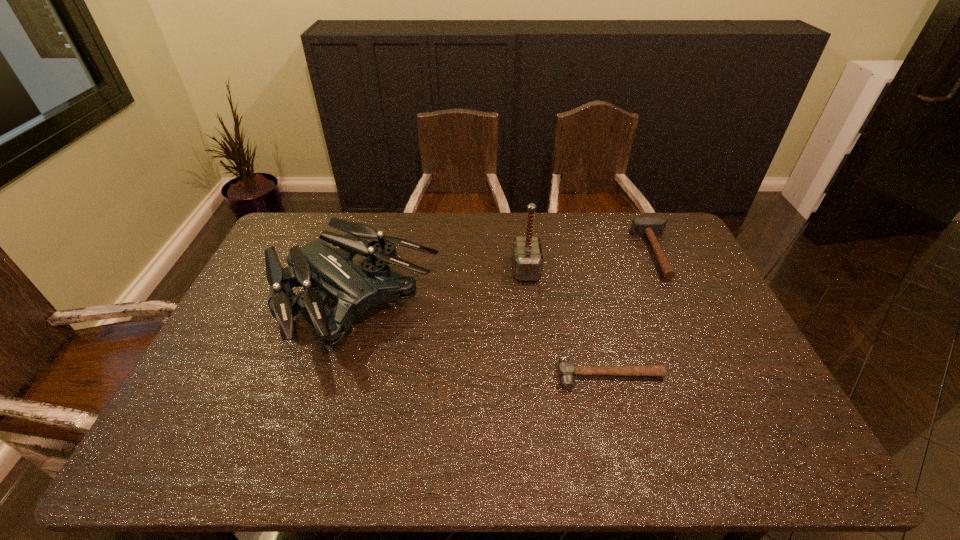
You are a GUI agent. You are given a task and a screenshot of the screen. Output one action in this format:
    pyautogui.click(x=<x>, y=<y>)
    Task: Click on the third object from right to left
    The height and width of the screenshot is (540, 960).
    Given the screenshot: What is the action you would take?
    pyautogui.click(x=527, y=256)

Where is `the leftmost hammer`? This screenshot has width=960, height=540. the leftmost hammer is located at coordinates (527, 256).

Where is `the leftmost object`? This screenshot has height=540, width=960. the leftmost object is located at coordinates (327, 263).

The image size is (960, 540). What are the coordinates of `drone` in the screenshot? It's located at (327, 263).

Find the location of `the third tallest object`. the third tallest object is located at coordinates (651, 227).

I want to click on the rightmost object, so click(651, 227).

This screenshot has width=960, height=540. Identify the location of the shortest hammer. (566, 369).

Locate an element on the screen. Image resolution: width=960 pixels, height=540 pixels. the nearest hammer is located at coordinates (566, 369).

Locate an element on the screen. The height and width of the screenshot is (540, 960). free space located 0.090m on the right of the tallest hammer is located at coordinates (566, 269).

Where is `free space located on the back of the leftmost object`? The width and height of the screenshot is (960, 540). free space located on the back of the leftmost object is located at coordinates (373, 242).